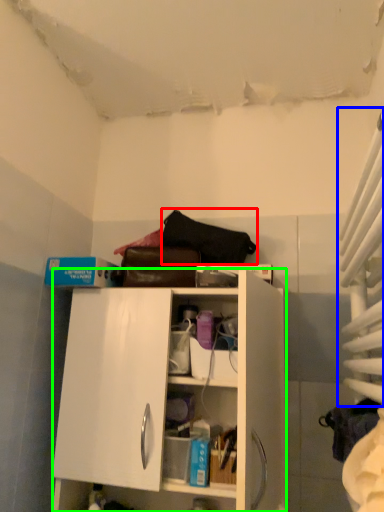
Question: Which is farther away from handbag (highlighted by a red box)? curtain (highlighted by a blue box) or cabinetry (highlighted by a green box)?

Choices:
 (A) curtain
 (B) cabinetry

Answer: (A)